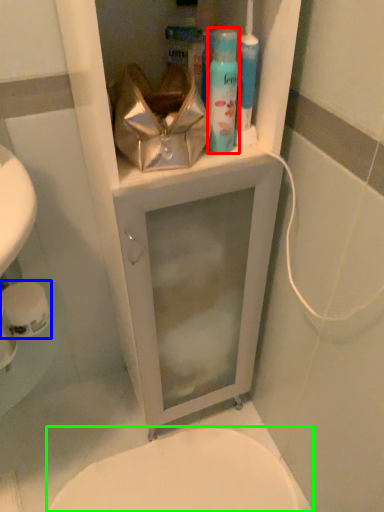
Question: Based on their relative distances, which object is farther from shaving cream (highlighted by a red box)? Choose from toilet paper (highlighted by a blue box) and bidet (highlighted by a green box).

Choices:
 (A) toilet paper
 (B) bidet

Answer: (B)